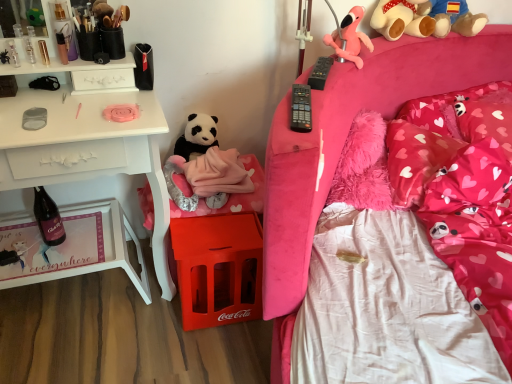
I want to click on vacant space in front of matte glass bottle at lower left, so point(47,263).